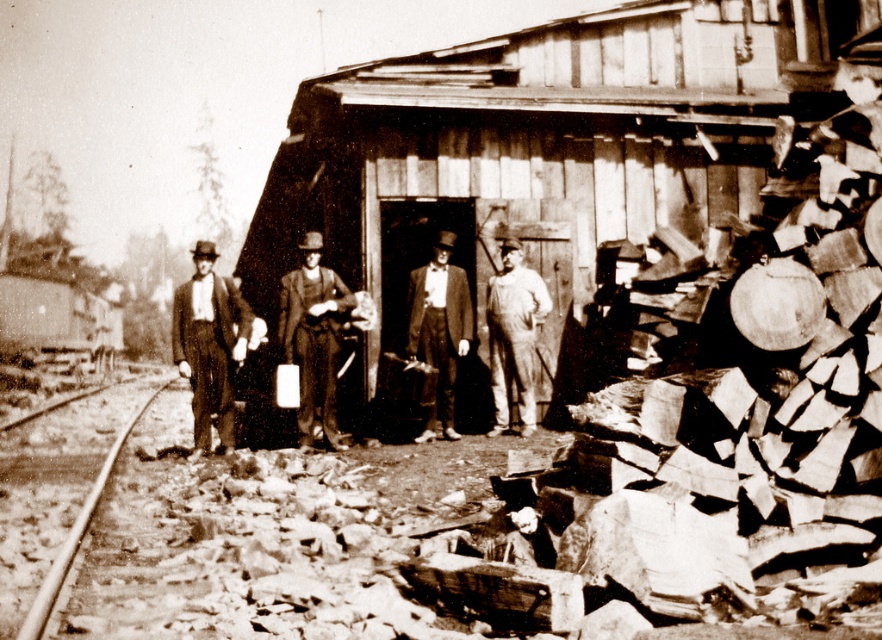
Which is more to the right, smooth leather hat at center or denim overalls at center?

denim overalls at center is more to the right.

Measure the distance between smooth leather hat at center and camera.

smooth leather hat at center and camera are 9.32 meters apart.

Consider the image. Who is more distant from viewer, (x=285, y=296) or (x=499, y=392)?

Point (x=285, y=296)

Where is `smooth leather hat at center`? smooth leather hat at center is located at coordinates (312, 337).

Is point (76, 513) more distant than point (172, 320)?

No, it is not.

Find the location of `smooth metal track at lower left`. smooth metal track at lower left is located at coordinates (57, 496).

Identify the location of smooth metal track at lower left. (57, 496).

Is smooth metal track at lower left positioned behind denim overalls at center?

No, smooth metal track at lower left is in front of denim overalls at center.

Which is behind, point (20, 573) or point (505, 241)?

The point (505, 241) is behind.

Which is in front, point (80, 509) or point (521, 300)?

Positioned in front is point (80, 509).

The height and width of the screenshot is (640, 882). Identify the location of smooth metal track at lower left. (57, 496).